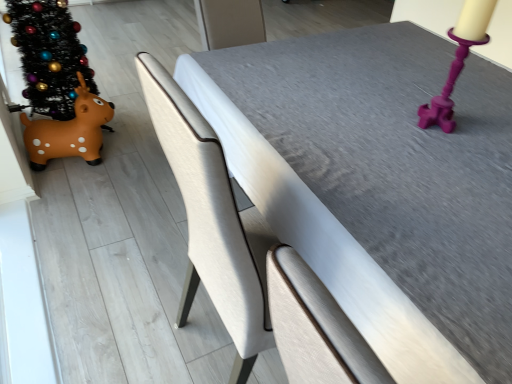
Locate an element on the screen. vacant space underneath brown rubber toy at left (from a real-world perspective) is located at coordinates (76, 162).